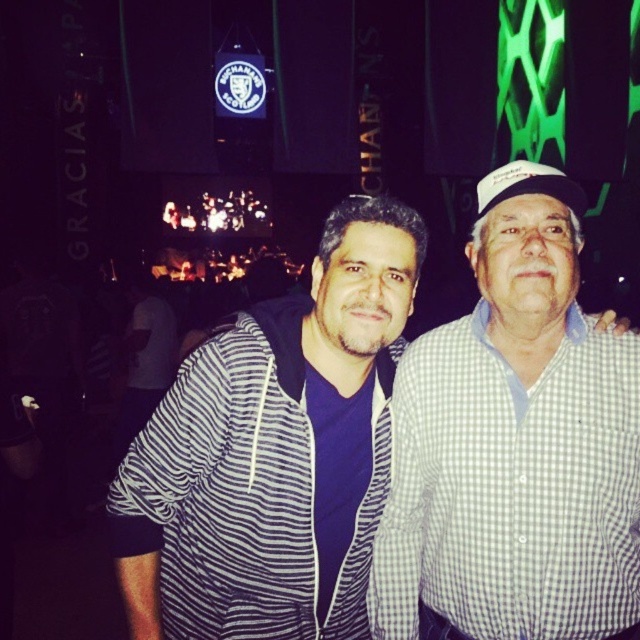
From the picture: You are at a social event and want to take a photo of the striped fabric shirt at center without anyone blocking it. Since the white checkered shirt at right is currently in front, can you move to the left side to capture an unobstructed view?

The white checkered shirt at right is in front of the striped fabric shirt at center, so moving to the left side might allow you to see the striped fabric shirt at center without obstruction from the white checkered shirt at right.

You are a photographer at the event and want to focus on the white checkered shirt at right and the white fabric baseball cap at upper right. Which object is nearer to the camera?

The white checkered shirt at right is closer to the viewer than the white fabric baseball cap at upper right, so the white checkered shirt at right is nearer to the camera.

You are at a social event and want to take a photo of the striped hoodie at center and the white fabric baseball cap at upper right. Which object should you focus on first if you want to capture both in the same frame without moving the camera?

You should focus on the striped hoodie at center first because it is positioned under the white fabric baseball cap at upper right, so adjusting the camera to include both would require ensuring the lower object is in frame first.